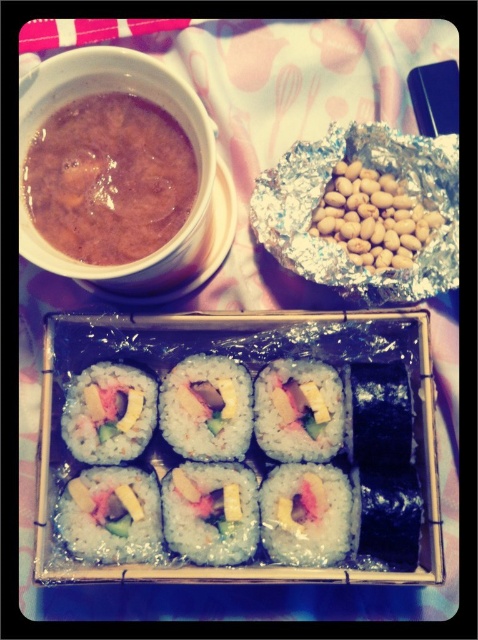
You are a food critic evaluating the meal setup. Based on the scene, which object is taller between the sushi at center and the shiny white rice roll at center?

The sushi at center is much taller than the shiny white rice roll at center.

You are a guest at a dinner party and see the brown matte soup at upper left and the white rice roll at center on the table. Which item is positioned higher up on the table?

The brown matte soup at upper left is positioned higher up on the table than the white rice roll at center.